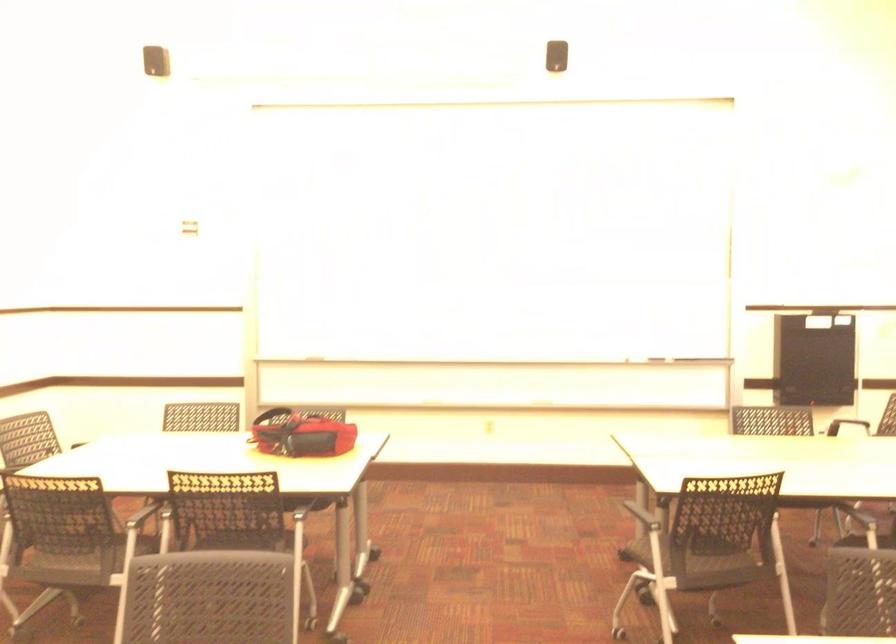
Where is `red bag handle`? This screenshot has width=896, height=644. red bag handle is located at coordinates (289, 420).